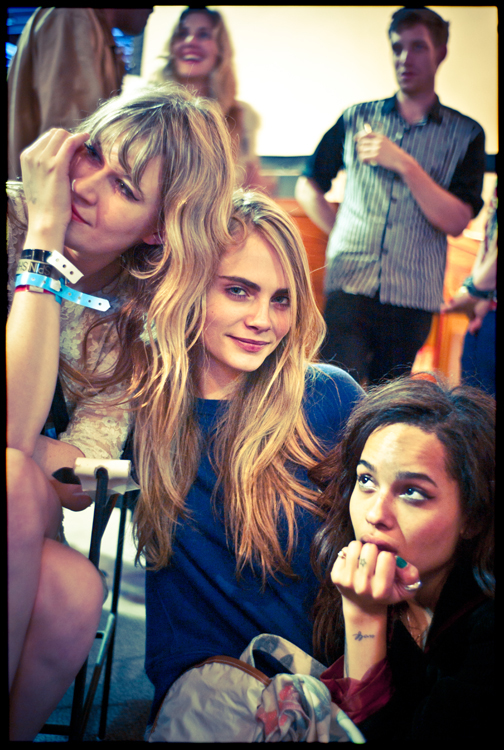
Where is `carpeted floor`? The height and width of the screenshot is (750, 504). carpeted floor is located at coordinates (123, 693), (128, 603).